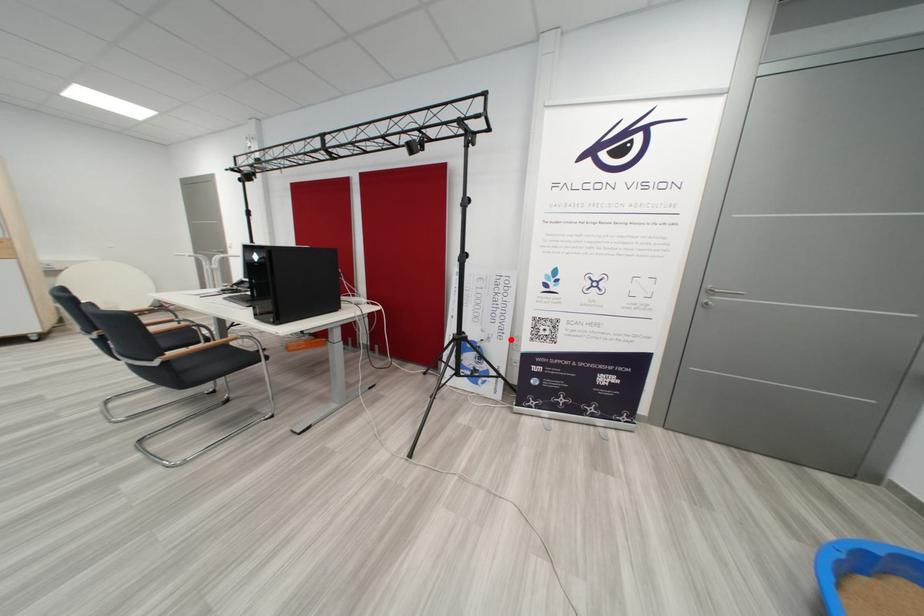
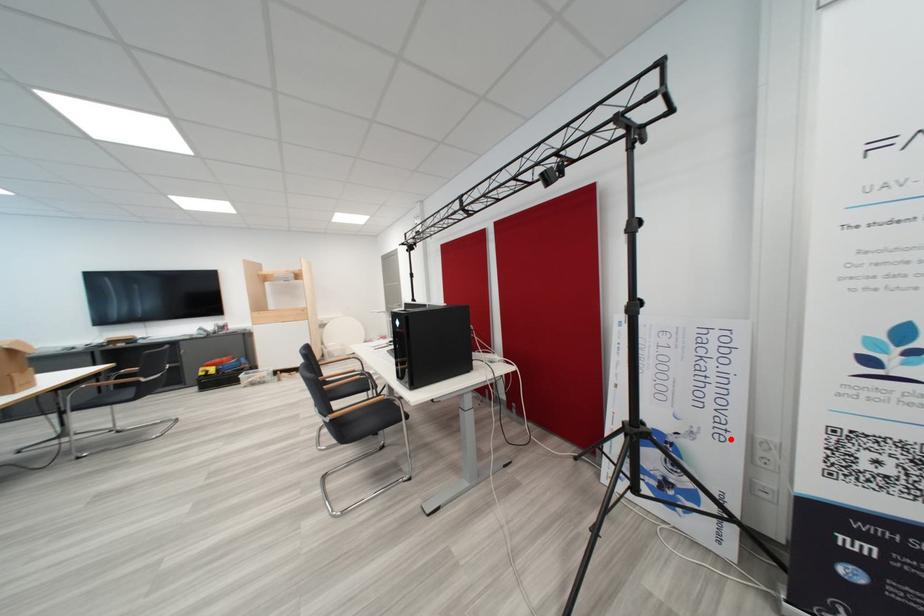
I am providing you with two images of the same scene from different viewpoints. A red point is marked on the first image and another point is marked on the second image. Are the points marked in image1 and image2 representing the same 3D position?

Yes